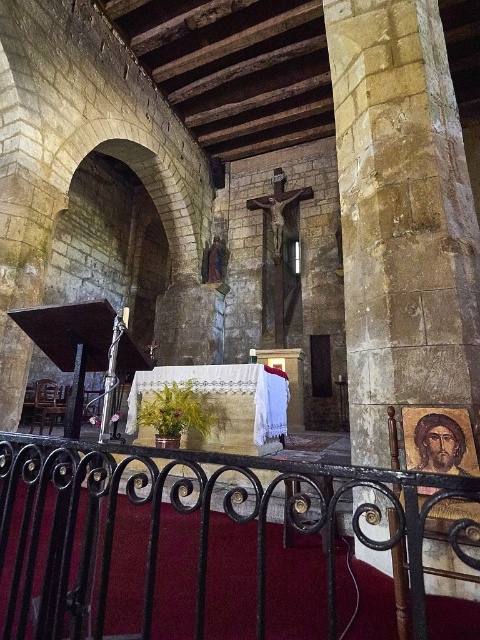
Can you confirm if black wrought iron railing at center is thinner than yellow stone pillar at center?

In fact, black wrought iron railing at center might be wider than yellow stone pillar at center.

Who is taller, black wrought iron railing at center or yellow stone pillar at center?

yellow stone pillar at center

What do you see at coordinates (175, 545) in the screenshot?
I see `black wrought iron railing at center` at bounding box center [175, 545].

Locate an element on the screen. The width and height of the screenshot is (480, 640). black wrought iron railing at center is located at coordinates (175, 545).